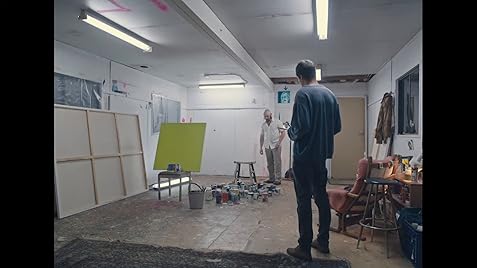
What are the coordinates of `ceiling` in the screenshot? It's located at (293, 32), (183, 46).